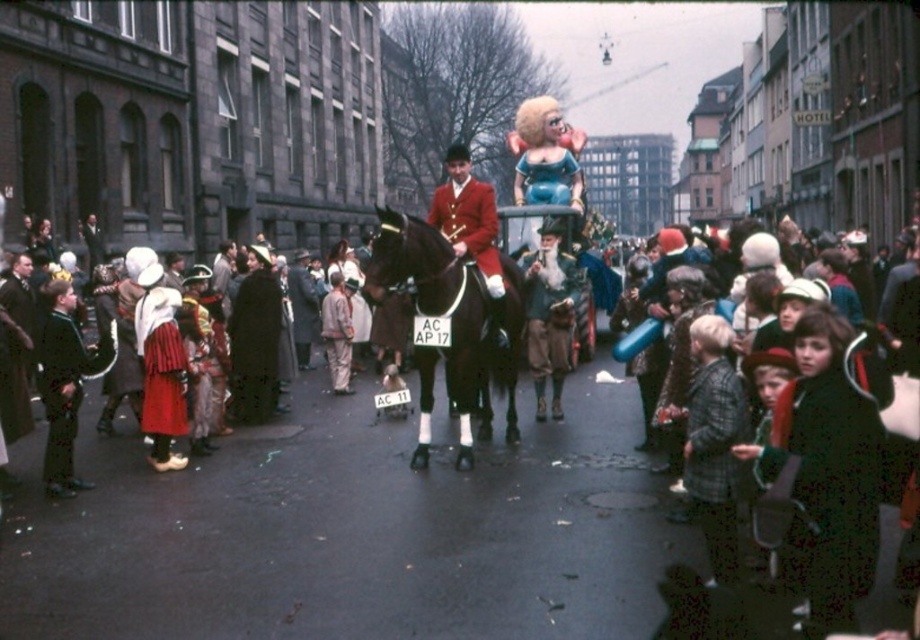
Does point (426, 365) come closer to viewer compared to point (466, 212)?

That is True.

Where is `shiny black horse at center`? This screenshot has height=640, width=920. shiny black horse at center is located at coordinates (446, 321).

Does point (461, 440) come behind point (489, 276)?

No, it is in front of (489, 276).

Where is `shiny black horse at center`? shiny black horse at center is located at coordinates (446, 321).

In the scene shown: Is red woolen coat at left thinner than red velvet santa claus at center?

Incorrect, red woolen coat at left's width is not less than red velvet santa claus at center's.

Between red woolen coat at left and red velvet santa claus at center, which one appears on the left side from the viewer's perspective?

red woolen coat at left

Between point (69, 384) and point (486, 282), which one is positioned in front?

Point (69, 384) is in front.

Find the location of a particular element. The height and width of the screenshot is (640, 920). red woolen coat at left is located at coordinates coord(67,378).

The image size is (920, 640). I want to click on plaid wool jacket at lower right, so click(x=713, y=442).

From the picture: Measure the distance from plaid wool jacket at lower right to red velvet santa claus at center.

plaid wool jacket at lower right and red velvet santa claus at center are 6.30 meters apart from each other.

Which is in front, point (719, 392) or point (483, 208)?

Point (719, 392) is more forward.

This screenshot has height=640, width=920. What are the coordinates of `plaid wool jacket at lower right` in the screenshot? It's located at (713, 442).